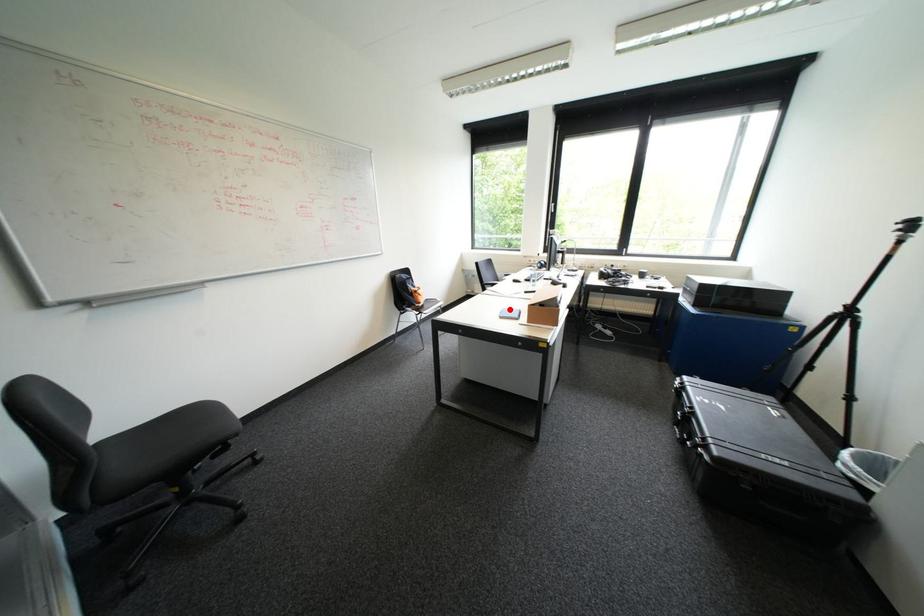
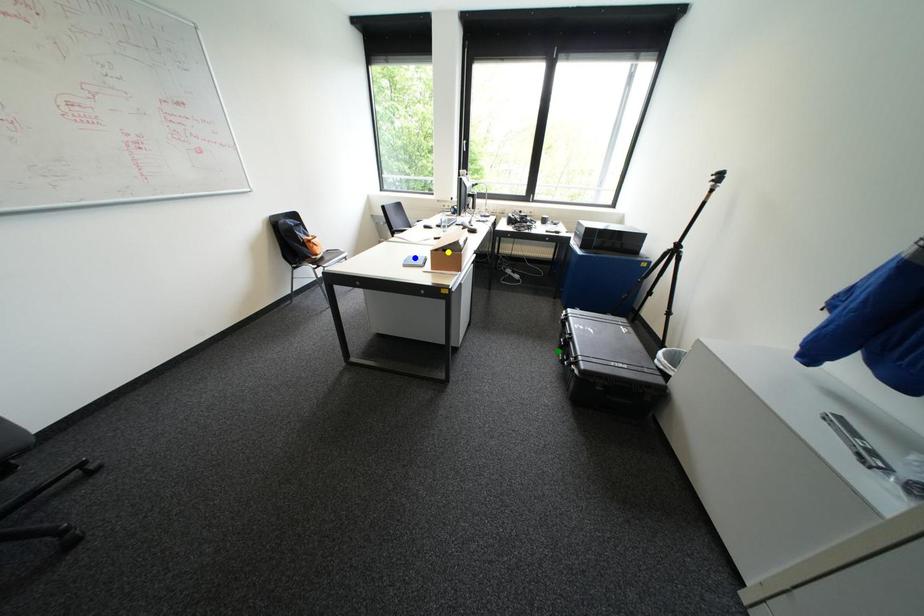
Question: I am providing you with two images of the same scene from different viewpoints. A red point is marked on the first image. You are given multiple points on the second image. Which mark in image 2 goes with the point in image 1?

Choices:
 (A) yellow point
 (B) green point
 (C) blue point

Answer: (C)